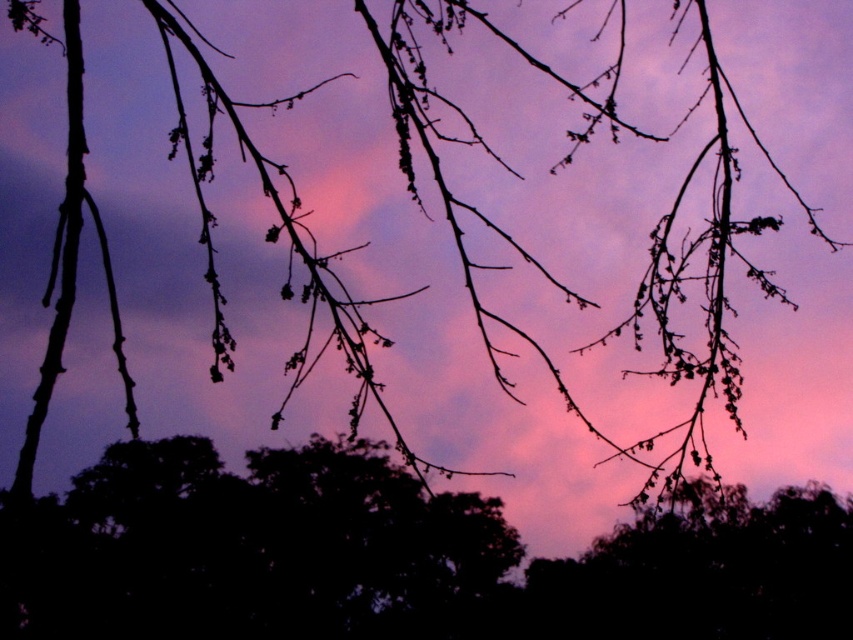
Question: Does silhouette branches at center appear over silvery branches at center?

Choices:
 (A) yes
 (B) no

Answer: (A)

Question: Can you confirm if silhouette branches at center is thinner than silvery branches at center?

Choices:
 (A) no
 (B) yes

Answer: (A)

Question: Which point is closer to the camera?

Choices:
 (A) (289, 493)
 (B) (570, 561)

Answer: (A)

Question: Does silhouette branches at center have a greater width compared to silvery branches at center?

Choices:
 (A) no
 (B) yes

Answer: (B)

Question: Which point is farther to the camera?

Choices:
 (A) (636, 544)
 (B) (73, 518)

Answer: (A)